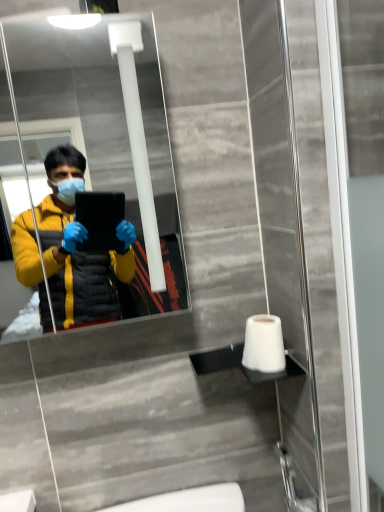
Question: Is white matte toilet paper at lower right to the left of matte black mirror at upper center from the viewer's perspective?

Choices:
 (A) yes
 (B) no

Answer: (B)

Question: Does white matte toilet paper at lower right have a greater height compared to matte black mirror at upper center?

Choices:
 (A) yes
 (B) no

Answer: (B)

Question: Is white matte toilet paper at lower right positioned in front of matte black mirror at upper center?

Choices:
 (A) yes
 (B) no

Answer: (B)

Question: Is white matte toilet paper at lower right bigger than matte black mirror at upper center?

Choices:
 (A) no
 (B) yes

Answer: (A)

Question: Is white matte toilet paper at lower right not near matte black mirror at upper center?

Choices:
 (A) no
 (B) yes

Answer: (B)

Question: Looking at the image, does matte black mirror at upper center seem bigger or smaller compared to transparent glass screen door at right?

Choices:
 (A) big
 (B) small

Answer: (A)

Question: In terms of width, does matte black mirror at upper center look wider or thinner when compared to transparent glass screen door at right?

Choices:
 (A) thin
 (B) wide

Answer: (B)

Question: In the image, is matte black mirror at upper center positioned in front of or behind transparent glass screen door at right?

Choices:
 (A) front
 (B) behind

Answer: (B)

Question: In the image, is matte black mirror at upper center on the left side or the right side of transparent glass screen door at right?

Choices:
 (A) left
 (B) right

Answer: (A)

Question: From the image's perspective, is white matte toilet paper at lower right positioned above or below matte black mirror at upper center?

Choices:
 (A) above
 (B) below

Answer: (B)

Question: Which is correct: white matte toilet paper at lower right is inside matte black mirror at upper center, or outside of it?

Choices:
 (A) outside
 (B) inside

Answer: (A)

Question: From a real-world perspective, relative to matte black mirror at upper center, is white matte toilet paper at lower right vertically above or below?

Choices:
 (A) below
 (B) above

Answer: (A)

Question: In terms of width, does white matte toilet paper at lower right look wider or thinner when compared to matte black mirror at upper center?

Choices:
 (A) wide
 (B) thin

Answer: (B)

Question: From the image's perspective, is transparent glass screen door at right above or below white matte toilet paper at lower right?

Choices:
 (A) above
 (B) below

Answer: (A)

Question: From their relative heights in the image, would you say transparent glass screen door at right is taller or shorter than white matte toilet paper at lower right?

Choices:
 (A) tall
 (B) short

Answer: (A)